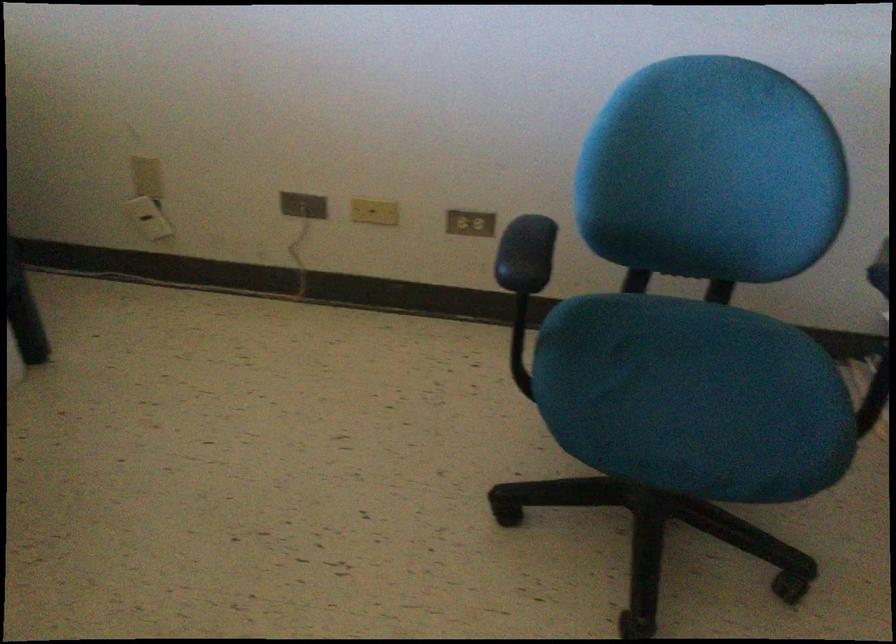
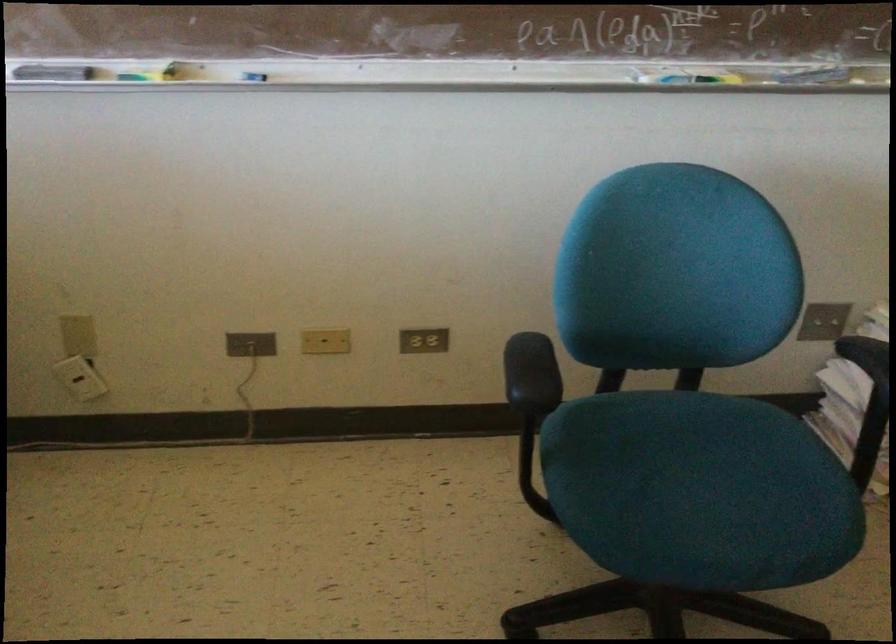
Question: Based on the continuous images, in which direction is the camera rotating? Reply with the corresponding letter.

Choices:
 (A) Left
 (B) Right
 (C) Up
 (D) Down

Answer: (B)